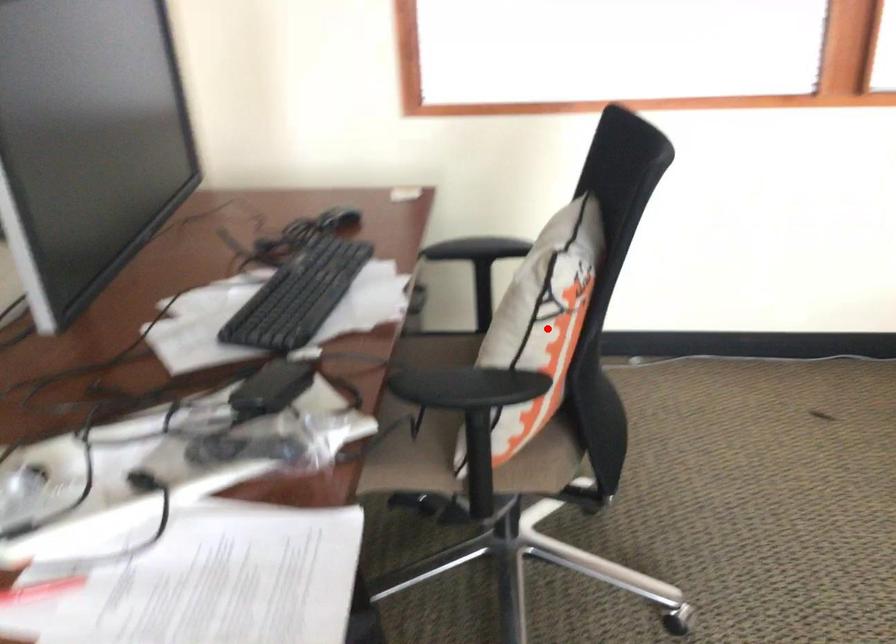
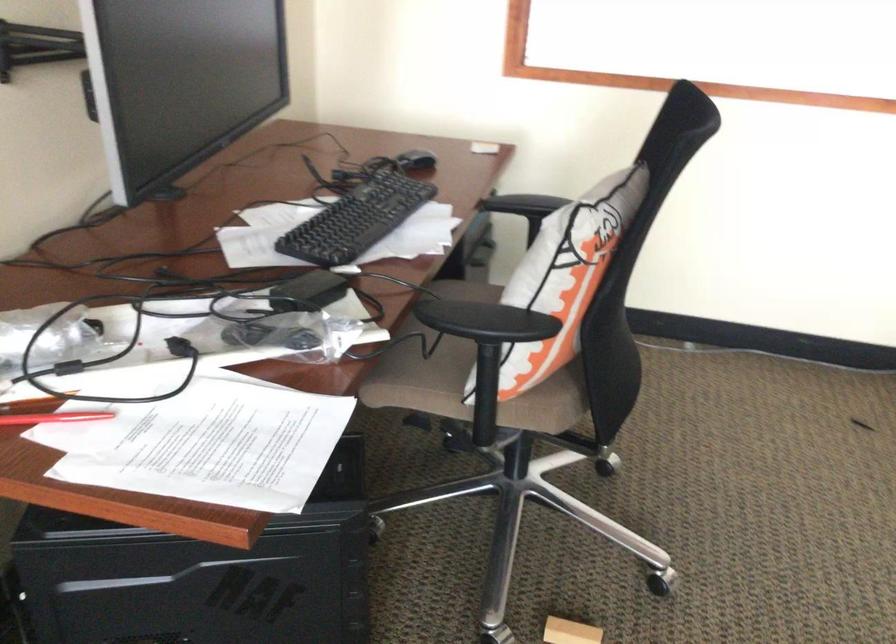
Locate, in the second image, the point that corresponds to the highlighted location in the first image.

(564, 277)